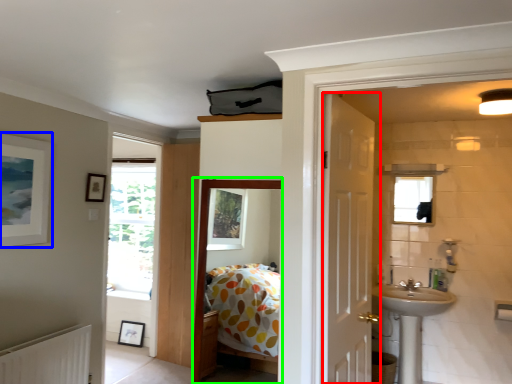
Question: Which is nearer to the door (highlighted by a red box)? picture frame (highlighted by a blue box) or corridor (highlighted by a green box).

Choices:
 (A) picture frame
 (B) corridor

Answer: (B)